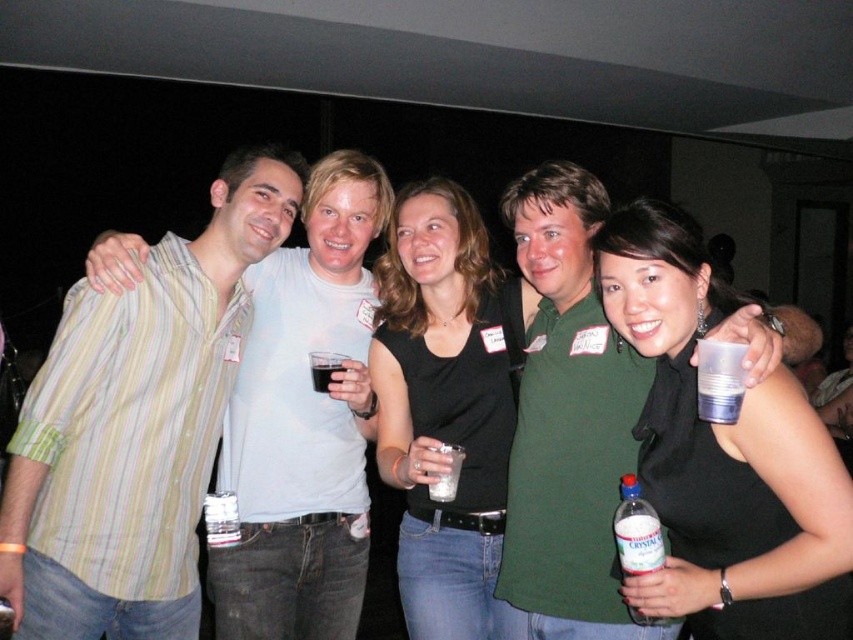
Who is more forward, (809, 621) or (355, 448)?

Point (809, 621)

Between black matte tank top at center and striped cotton shirt at left, which one has less height?

black matte tank top at center

What are the coordinates of `black matte tank top at center` in the screenshot? It's located at (724, 458).

Which is behind, point (323, 596) or point (218, 547)?

The point (323, 596) is more distant.

The height and width of the screenshot is (640, 853). I want to click on striped cotton shirt at left, so click(x=305, y=422).

Can you confirm if striped cotton shirt at left is positioned above dark liquid glass at center?

Incorrect, striped cotton shirt at left is not positioned above dark liquid glass at center.

Can you confirm if striped cotton shirt at left is taller than dark liquid glass at center?

Correct, striped cotton shirt at left is much taller as dark liquid glass at center.

Which is in front, point (296, 618) or point (326, 380)?

Point (326, 380) is more forward.

Image resolution: width=853 pixels, height=640 pixels. I want to click on striped cotton shirt at left, so pyautogui.click(x=305, y=422).